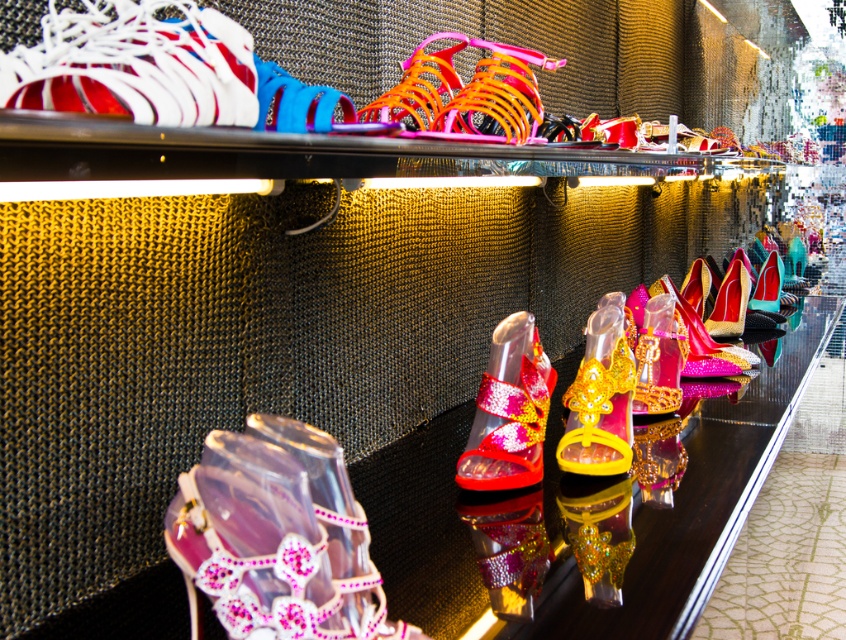
You are a customer in a shoe store and want to examine the shiny pink glitter sandal at center and the shiny gold sandal at center. Which one is easier to reach without moving your current position?

The shiny pink glitter sandal at center is closer to the viewer than the shiny gold sandal at center, so it is easier to reach without moving.